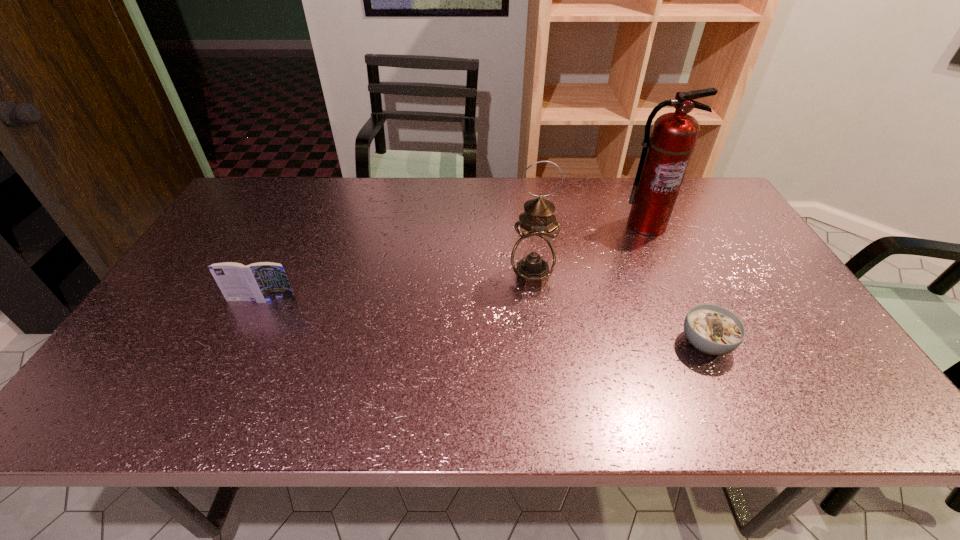
I want to click on free space that satisfies the following two spatial constraints: 1. on the front cover of the nearest object; 2. on the left side of the book, so click(241, 343).

This screenshot has height=540, width=960. In order to click on free region that satisfies the following two spatial constraints: 1. on the front cover of the third tallest object; 2. on the left side of the soup bowl in this screenshot , I will do `click(241, 343)`.

Image resolution: width=960 pixels, height=540 pixels. In order to click on vacant area that satisfies the following two spatial constraints: 1. on the front side of the third object from right to left; 2. on the left side of the nearest object in this screenshot , I will do `click(540, 343)`.

This screenshot has height=540, width=960. I want to click on free space in the image that satisfies the following two spatial constraints: 1. on the nozzle side of the tallest object; 2. on the left side of the soup bowl, so click(x=701, y=343).

At what (x,y) coordinates should I click in order to perform the action: click on free location that satisfies the following two spatial constraints: 1. on the front cover of the soup bowl; 2. on the left side of the leftmost object. Please return your answer as a coordinate pair (x, y). This screenshot has height=540, width=960. Looking at the image, I should click on (241, 343).

This screenshot has height=540, width=960. I want to click on free region that satisfies the following two spatial constraints: 1. on the nozzle side of the nearest object; 2. on the left side of the farthest object, so click(701, 343).